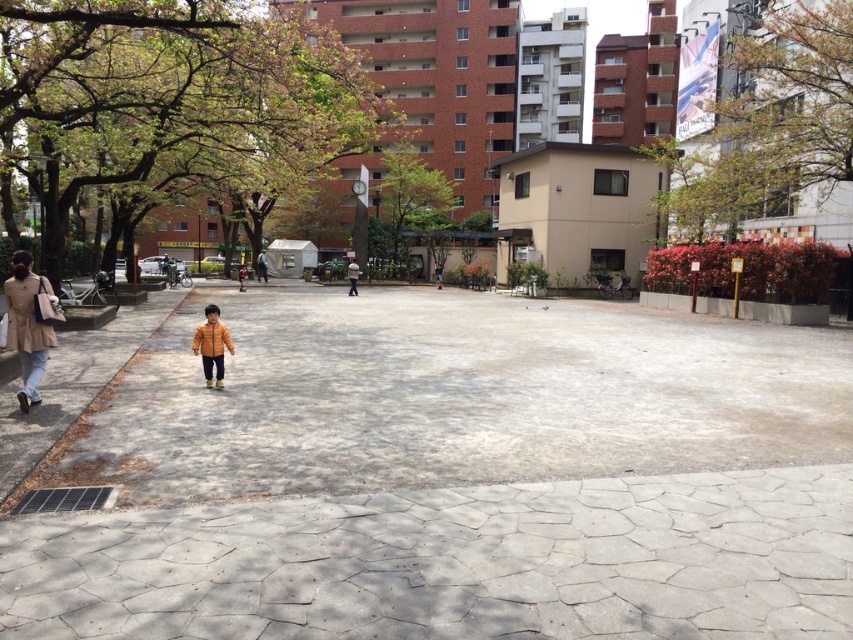
You are a delivery person trying to navigate through the park. You see the gray concrete pavement at center and the yellow matte jacket at center. Which path should you choose to ensure you have enough space for your cart?

The gray concrete pavement at center has a larger width than the yellow matte jacket at center, so you should choose the gray concrete pavement at center to ensure enough space for your cart.

Looking at this image, you are a delivery person trying to navigate through the park. You see the gray concrete pavement at center and the yellow matte jacket at center. Which object is positioned higher in the image?

The gray concrete pavement at center is located above the yellow matte jacket at center, so the gray concrete pavement at center is positioned higher in the image.